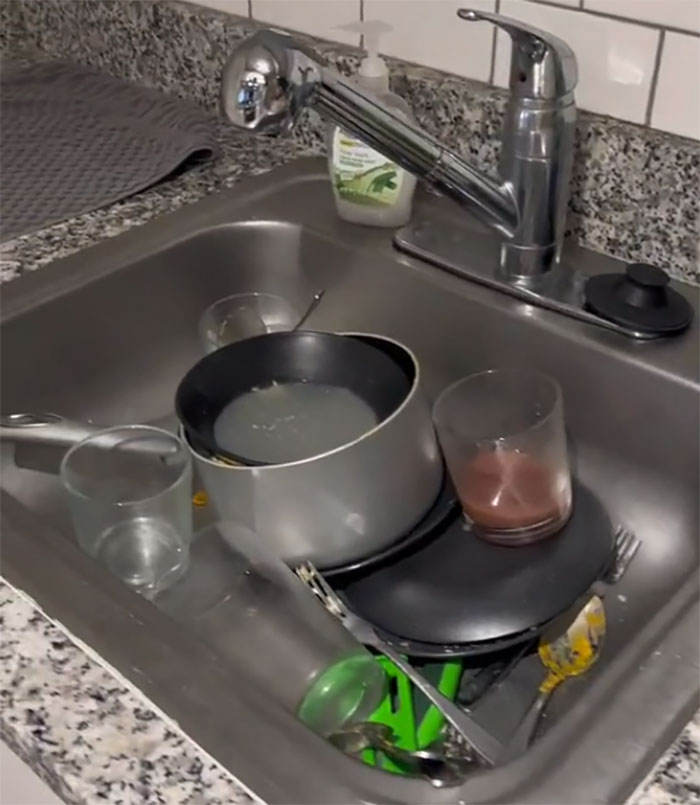
Find the location of a particular element. glass is located at coordinates (160, 518), (514, 477), (242, 320).